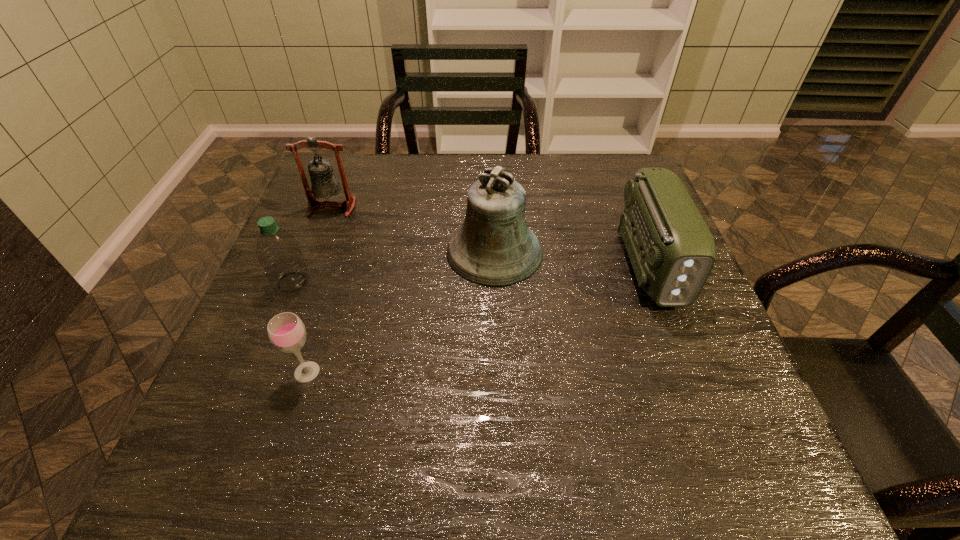
At what (x,y) coordinates should I click in order to perform the action: click on the third closest object to the nearer bell. Please return your answer as a coordinate pair (x, y). Looking at the image, I should click on (286, 331).

Where is `object that stands as the closest to the shortest object`? This screenshot has width=960, height=540. object that stands as the closest to the shortest object is located at coordinates (278, 252).